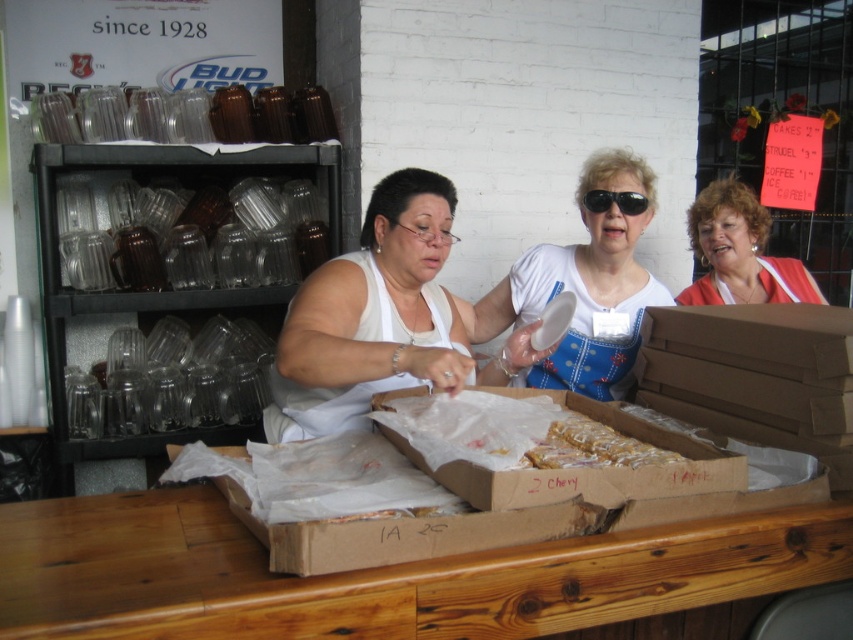
You are a customer at the market stall and want to place an order. You have a small gift box that is 3 inches wide. Can you place it on the wooden table at center without it overlapping with the brown cardboard box at lower center?

The wooden table at center is 3.89 inches from the brown cardboard box at lower center. Since the gift box is 3 inches wide, there is enough space between them to place the gift box without overlapping.

You are setting up a booth at a fair and need to decide where to place a large banner. The banner is wider than the wooden table at center. Since the banner must be placed on the same surface as the white fabric apron at center, will it fit if you put it there?

The wooden table at center is smaller than the white fabric apron at center. Since the banner is wider than the wooden table at center, it may still fit on the surface where the white fabric apron at center is placed, provided the apron area is larger. However, the exact fit depends on the apron surface size, which isn